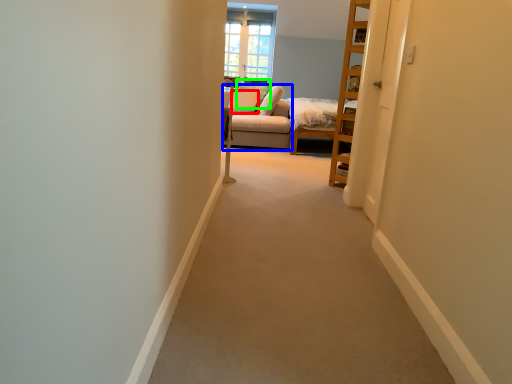
Question: Estimate the real-world distances between objects in this image. Which object is farther from pillow (highlighted by a red box), couch (highlighted by a blue box) or pillow (highlighted by a green box)?

Choices:
 (A) couch
 (B) pillow

Answer: (A)